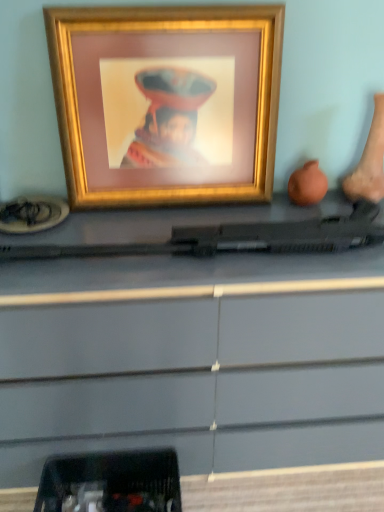
Question: Is black plastic tray at lower left closer to the viewer compared to matte black gun at center?

Choices:
 (A) no
 (B) yes

Answer: (A)

Question: Is black plastic tray at lower left at the left side of matte black gun at center?

Choices:
 (A) no
 (B) yes

Answer: (B)

Question: Does black plastic tray at lower left have a lesser height compared to matte black gun at center?

Choices:
 (A) no
 (B) yes

Answer: (B)

Question: Could you tell me if black plastic tray at lower left is turned towards matte black gun at center?

Choices:
 (A) no
 (B) yes

Answer: (A)

Question: Is black plastic tray at lower left smaller than matte black gun at center?

Choices:
 (A) no
 (B) yes

Answer: (B)

Question: From a real-world perspective, is gold metallic picture frame at upper center positioned above or below matte black gun at center?

Choices:
 (A) above
 (B) below

Answer: (A)

Question: Considering the positions of gold metallic picture frame at upper center and matte black gun at center in the image, is gold metallic picture frame at upper center bigger or smaller than matte black gun at center?

Choices:
 (A) big
 (B) small

Answer: (B)

Question: Considering the positions of point (203, 164) and point (337, 323), is point (203, 164) closer or farther from the camera than point (337, 323)?

Choices:
 (A) farther
 (B) closer

Answer: (A)

Question: Considering the relative positions of gold metallic picture frame at upper center and matte black gun at center in the image provided, is gold metallic picture frame at upper center to the left or to the right of matte black gun at center?

Choices:
 (A) right
 (B) left

Answer: (B)

Question: Which is correct: gold metallic picture frame at upper center is inside black plastic tray at lower left, or outside of it?

Choices:
 (A) outside
 (B) inside

Answer: (A)

Question: Based on their sizes in the image, would you say gold metallic picture frame at upper center is bigger or smaller than black plastic tray at lower left?

Choices:
 (A) big
 (B) small

Answer: (A)

Question: Is gold metallic picture frame at upper center in front of or behind black plastic tray at lower left in the image?

Choices:
 (A) front
 (B) behind

Answer: (A)

Question: From a real-world perspective, relative to black plastic tray at lower left, is gold metallic picture frame at upper center vertically above or below?

Choices:
 (A) below
 (B) above

Answer: (B)

Question: Is point (14, 484) positioned closer to the camera than point (261, 49)?

Choices:
 (A) closer
 (B) farther

Answer: (B)

Question: Visually, is matte black gun at center positioned to the left or to the right of gold metallic picture frame at upper center?

Choices:
 (A) left
 (B) right

Answer: (B)